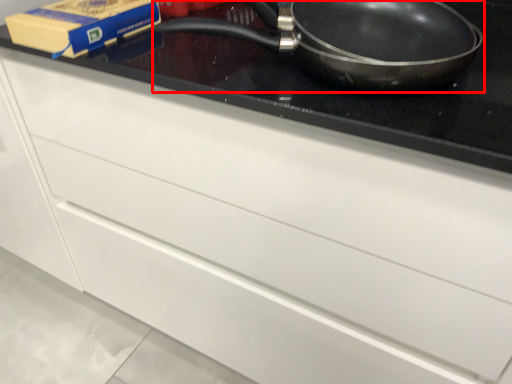
Question: Where is frying pan (annotated by the red box) located in relation to paperback book in the image?

Choices:
 (A) right
 (B) left

Answer: (A)